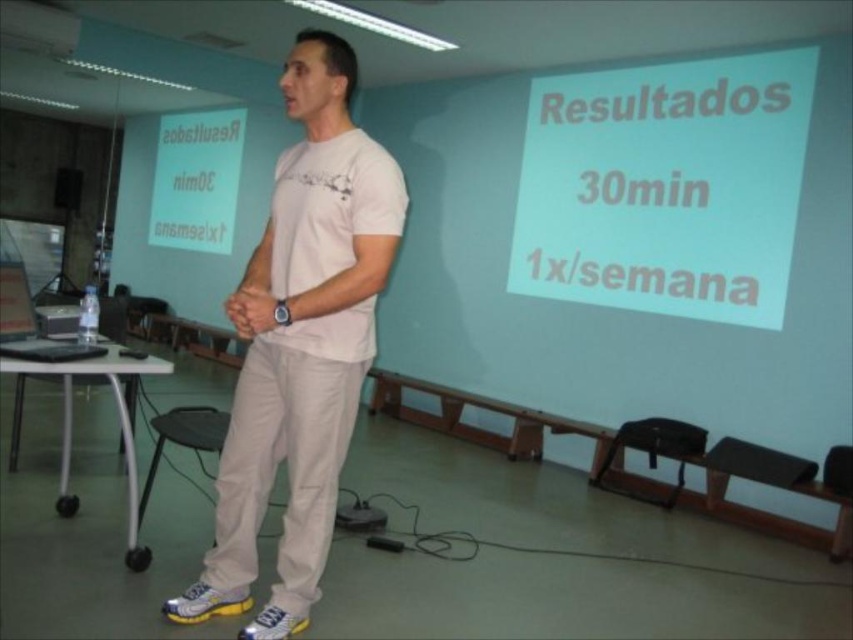
Question: Can you confirm if white cotton t-shirt at center is positioned to the right of matte skin hands at center?

Choices:
 (A) yes
 (B) no

Answer: (A)

Question: Can you confirm if white paper at upper center is positioned to the left of white cotton t-shirt at center?

Choices:
 (A) yes
 (B) no

Answer: (B)

Question: Which of these objects is positioned closest to the matte skin hands at center?

Choices:
 (A) white cotton t-shirt at center
 (B) white matte projection screen at upper left

Answer: (A)

Question: Is white cotton t-shirt at center to the right of matte skin hands at center from the viewer's perspective?

Choices:
 (A) no
 (B) yes

Answer: (B)

Question: Which object is positioned farthest from the white cotton t-shirt at center?

Choices:
 (A) matte skin hands at center
 (B) white matte projection screen at upper left
 (C) white paper at upper center

Answer: (B)

Question: Which point is closer to the camera?

Choices:
 (A) (234, 317)
 (B) (184, 140)
 (C) (781, 80)

Answer: (A)